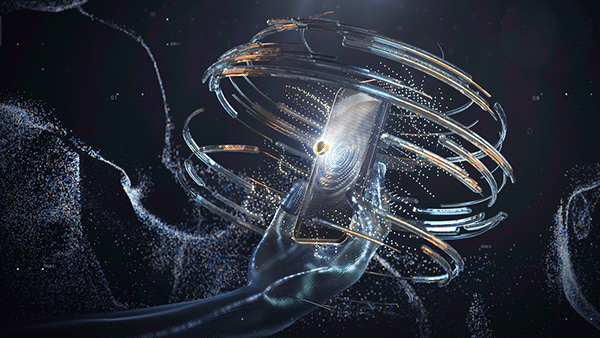
Image resolution: width=600 pixels, height=338 pixels. In order to click on phone in this screenshot , I will do `click(334, 166)`.